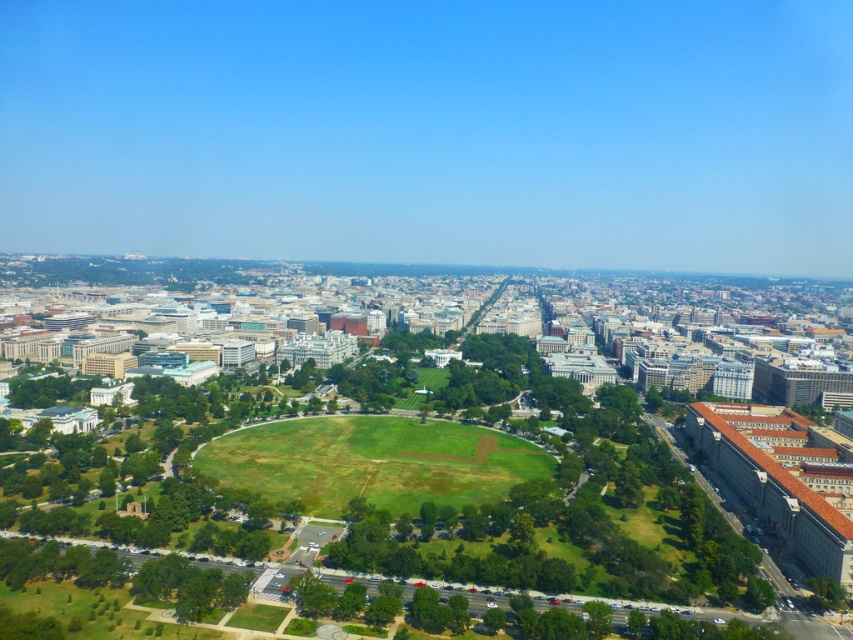
Question: Which point appears farthest from the camera in this image?

Choices:
 (A) (659, 538)
 (B) (267, 440)

Answer: (B)

Question: Can you confirm if green leafy tree at center is thinner than green grassy field at center?

Choices:
 (A) yes
 (B) no

Answer: (B)

Question: Which point is farther from the camera taking this photo?

Choices:
 (A) (671, 580)
 (B) (404, 422)

Answer: (B)

Question: Considering the relative positions of green leafy tree at center and green grassy field at center in the image provided, where is green leafy tree at center located with respect to green grassy field at center?

Choices:
 (A) left
 (B) right

Answer: (B)

Question: Is green leafy tree at center in front of green grassy field at center?

Choices:
 (A) no
 (B) yes

Answer: (B)

Question: Which of the following is the closest to the observer?

Choices:
 (A) (418, 572)
 (B) (251, 426)

Answer: (A)